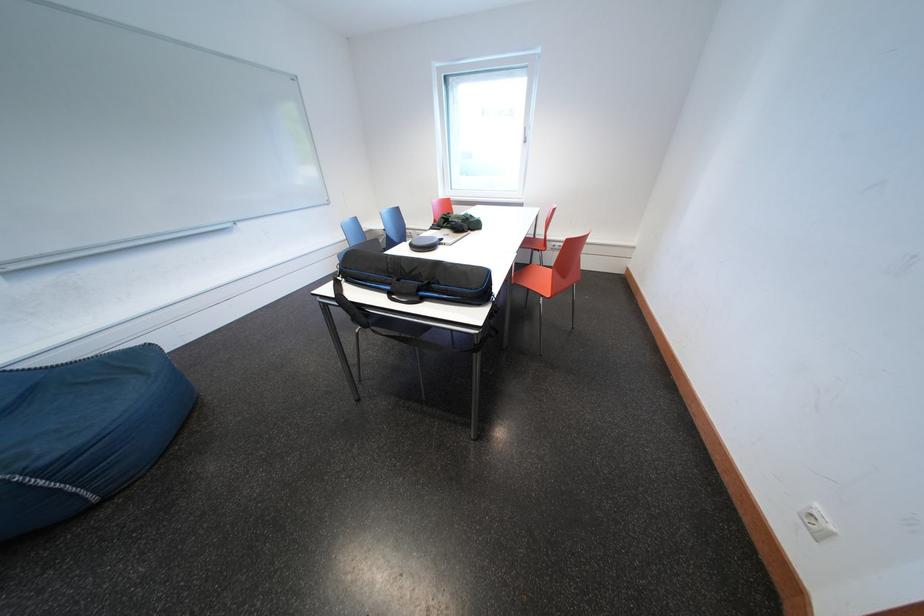
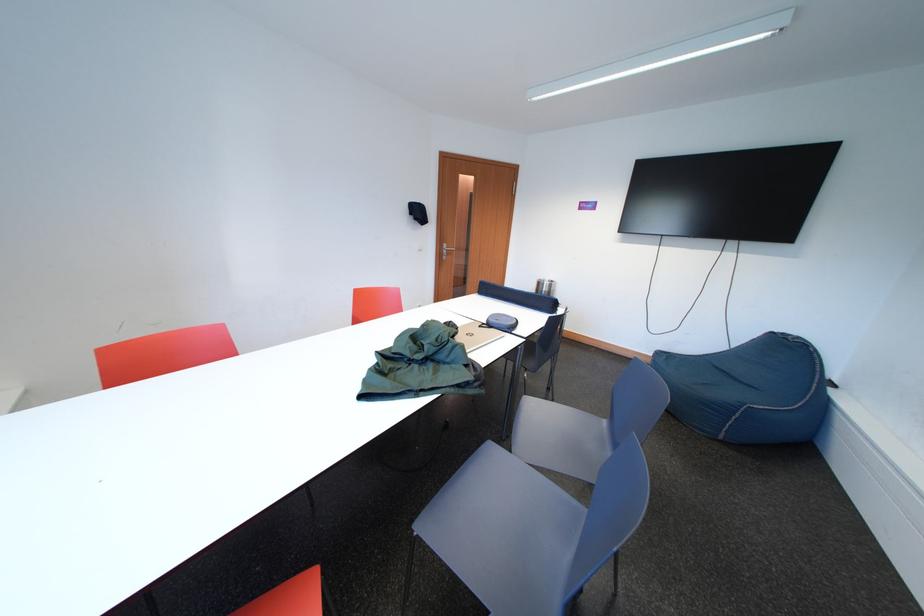
Question: I am providing you with two images of the same scene from different viewpoints. After the viewpoint changes to image2, which objects are now occluded?

Choices:
 (A) white humidifier
 (B) metal door handle
 (C) closed silver laptop
 (D) orange chair sitting surface

Answer: (D)